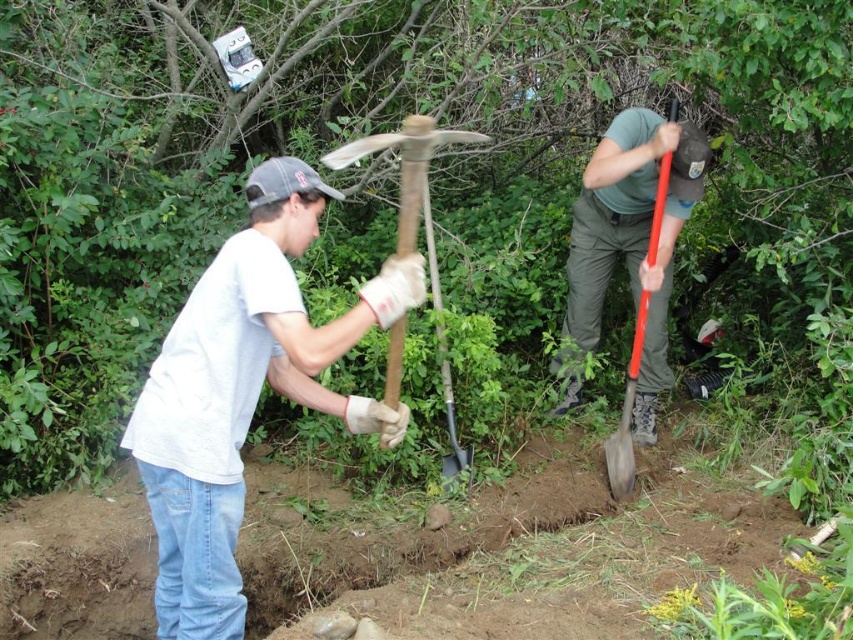
Does green matte shovel at center have a greater width compared to gray fabric baseball cap at upper center?

Yes.

Does green matte shovel at center have a greater height compared to gray fabric baseball cap at upper center?

Indeed, green matte shovel at center has a greater height compared to gray fabric baseball cap at upper center.

Is point (602, 218) positioned before point (328, 196)?

No.

Find the location of `green matte shovel at center`. green matte shovel at center is located at coordinates [x=631, y=237].

Is white matte shirt at center to the left of wooden pickaxe at center from the viewer's perspective?

Indeed, white matte shirt at center is positioned on the left side of wooden pickaxe at center.

Does point (213, 294) come behind point (428, 250)?

No, (213, 294) is in front of (428, 250).

Locate an element on the screen. The width and height of the screenshot is (853, 640). white matte shirt at center is located at coordinates (242, 403).

This screenshot has height=640, width=853. What do you see at coordinates (242, 403) in the screenshot?
I see `white matte shirt at center` at bounding box center [242, 403].

Between white matte shirt at center and gray fabric baseball cap at upper center, which one has less height?

With less height is gray fabric baseball cap at upper center.

Is point (296, 234) positioned before point (293, 168)?

No, (296, 234) is behind (293, 168).

This screenshot has height=640, width=853. What are the coordinates of `white matte shirt at center` in the screenshot? It's located at (242, 403).